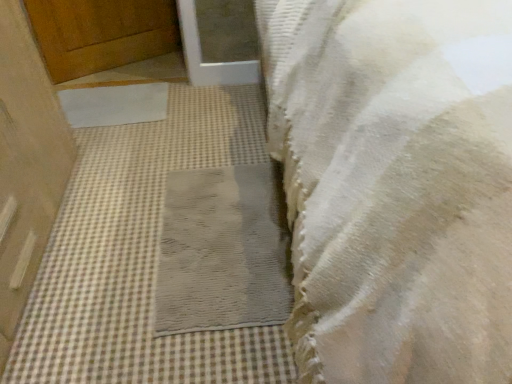
Locate an element on the screen. The image size is (512, 384). free point to the right of white matte mat at center, the 2th mat in the bottom-to-top sequence is located at coordinates (200, 109).